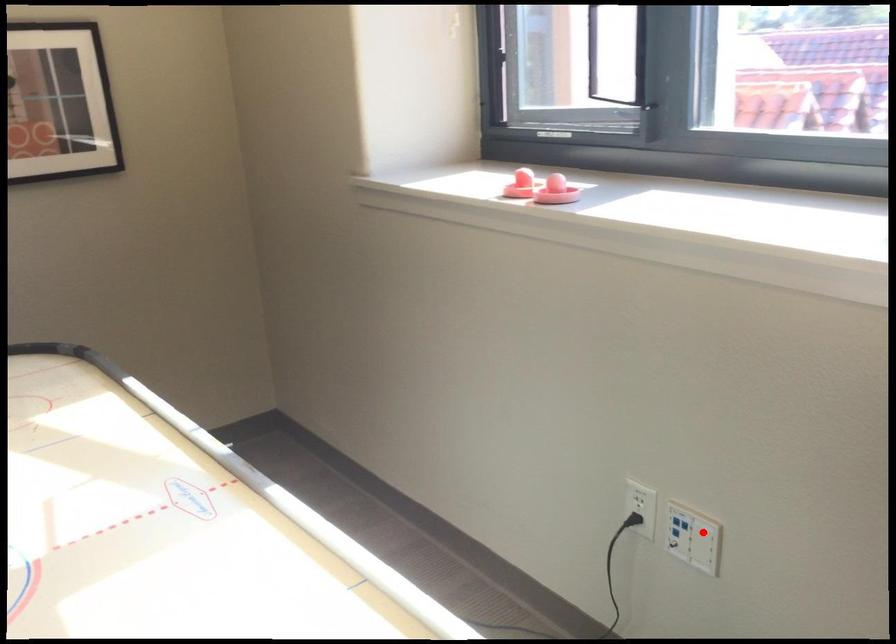
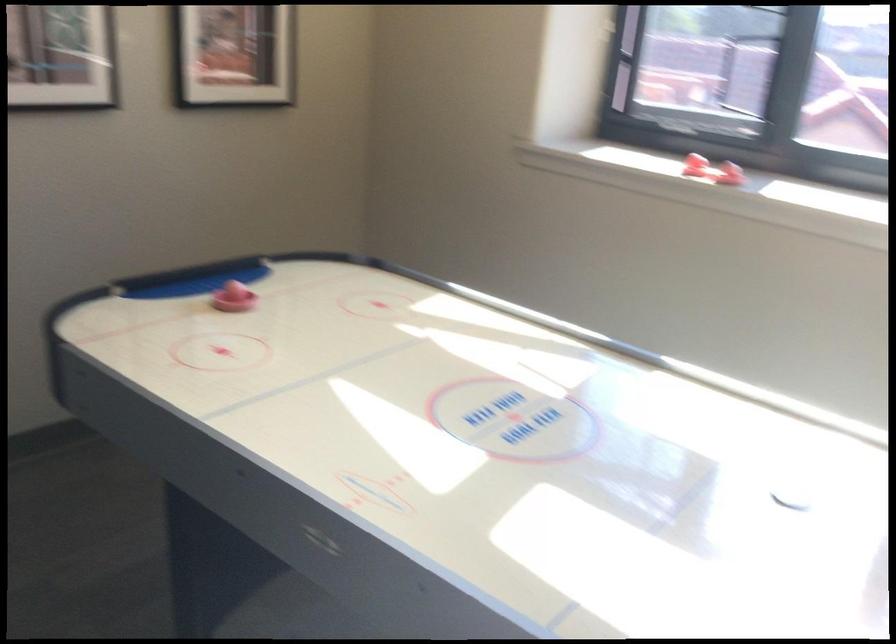
Question: I am providing you with two images of the same scene from different viewpoints. A red point is marked on the first image. Is the red point's position out of view in image 2?

Choices:
 (A) Yes
 (B) No

Answer: (A)